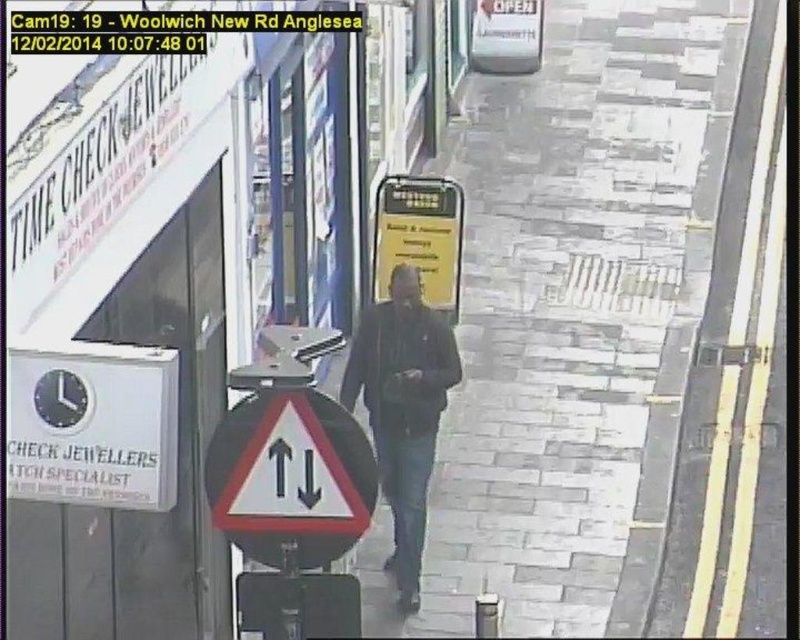
Question: Does gray stone pavement at center have a greater width compared to white plastic traffic sign at center?

Choices:
 (A) no
 (B) yes

Answer: (B)

Question: Estimate the real-world distances between objects in this image. Which object is closer to the white plastic traffic sign at center?

Choices:
 (A) gray stone pavement at center
 (B) yellow paper sign at center

Answer: (A)

Question: Which point is farther to the camera?

Choices:
 (A) white plastic traffic sign at center
 (B) gray stone pavement at center
 (C) yellow paper sign at center

Answer: (C)

Question: Can you confirm if gray stone pavement at center is positioned below yellow paper sign at center?

Choices:
 (A) yes
 (B) no

Answer: (B)

Question: Is gray stone pavement at center smaller than dark blue jacket at center?

Choices:
 (A) yes
 (B) no

Answer: (B)

Question: Which object is positioned farthest from the yellow paper sign at center?

Choices:
 (A) white plastic traffic sign at center
 (B) dark blue jacket at center
 (C) gray stone pavement at center

Answer: (A)